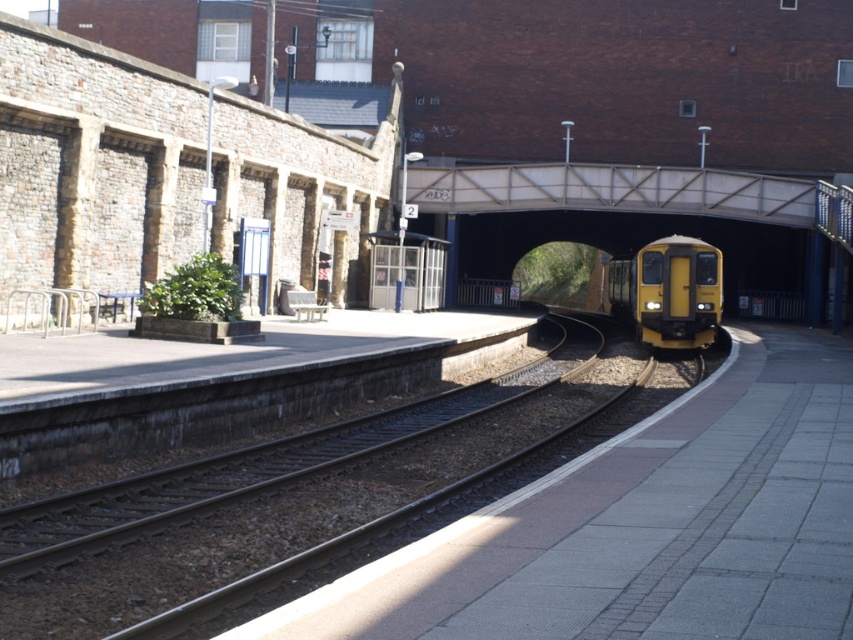
In the scene shown: You are a maintenance worker needing to walk across either the smooth metal track at center or the metallic gray bridge at upper center. Which one is wider and thus safer for walking?

The metallic gray bridge at upper center is wider than the smooth metal track at center, so it is safer for walking.